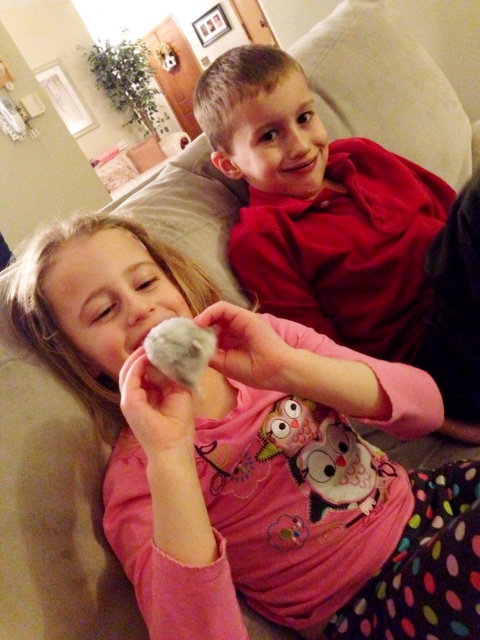
Question: Can you confirm if fluffy pink owl at center is bigger than matte red shirt at upper right?

Choices:
 (A) no
 (B) yes

Answer: (B)

Question: Which is farther from the matte red shirt at upper right?

Choices:
 (A) fluffy white paw at center
 (B) fluffy pink owl at center

Answer: (A)

Question: Which point appears closest to the camera in this image?

Choices:
 (A) (441, 602)
 (B) (313, 138)
 (C) (182, 348)

Answer: (C)

Question: Where is fluffy pink owl at center located in relation to matte red shirt at upper right in the image?

Choices:
 (A) below
 (B) above

Answer: (A)

Question: Does fluffy pink owl at center appear on the right side of fluffy white paw at center?

Choices:
 (A) no
 (B) yes

Answer: (B)

Question: Which of these objects is positioned farthest from the fluffy pink owl at center?

Choices:
 (A) fluffy white paw at center
 (B) matte red shirt at upper right

Answer: (B)